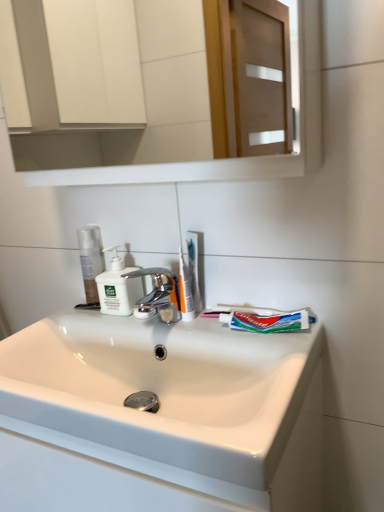
Question: Looking at the image, does translucent plastic toothbrush at center seem bigger or smaller compared to white matte soap dispenser at center?

Choices:
 (A) big
 (B) small

Answer: (B)

Question: In the image, is translucent plastic toothbrush at center positioned in front of or behind white matte soap dispenser at center?

Choices:
 (A) behind
 (B) front

Answer: (B)

Question: Which is nearer to the clear plastic bottle at left?

Choices:
 (A) translucent plastic toothbrush at center
 (B) green matte toothpaste at center
 (C) white glossy sink at center
 (D) chrome metallic faucet at center
 (E) white glossy mirror at upper center

Answer: (D)

Question: Which object is positioned farthest from the white matte soap dispenser at center?

Choices:
 (A) clear plastic bottle at left
 (B) translucent plastic toothbrush at center
 (C) translucent plastic toothbrush at center
 (D) chrome metallic faucet at center
 (E) white glossy sink at center

Answer: (E)